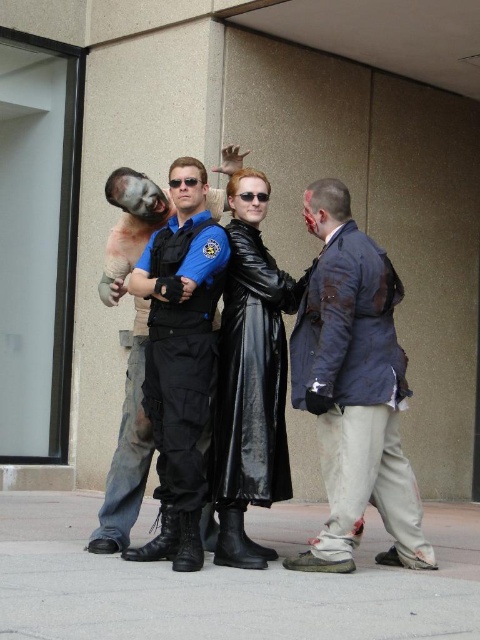
This screenshot has height=640, width=480. I want to click on dark blue suit at right, so click(x=354, y=388).

Which of these two, dark blue suit at right or black matte sunglasses at center, stands shorter?

Standing shorter between the two is black matte sunglasses at center.

Where is `dark blue suit at right`? dark blue suit at right is located at coordinates (354, 388).

Which is in front, point (104, 288) or point (192, 179)?

Positioned in front is point (192, 179).

Can you confirm if matte black uniform at center is positioned to the left of sunglasses at center?

Indeed, matte black uniform at center is positioned on the left side of sunglasses at center.

Is point (94, 545) positioned in front of point (191, 180)?

Yes, point (94, 545) is in front of point (191, 180).

Identify the location of matte black uniform at center. (127, 451).

Is the position of sunglasses at center less distant than that of black matte sunglasses at center?

Yes.

Measure the distance between sunglasses at center and camera.

sunglasses at center is 16.90 feet away from camera.

Is point (190, 182) farther from camera compared to point (253, 193)?

No, (190, 182) is closer to viewer.

Identify the location of sunglasses at center. (184, 180).